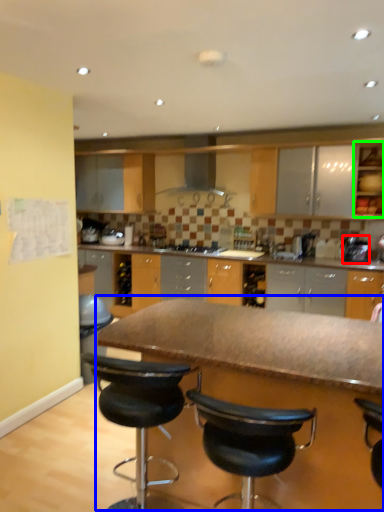
Question: Based on their relative distances, which object is farther from appliance (highlighted by a red box)? Choose from table (highlighted by a blue box) and cabinetry (highlighted by a green box).

Choices:
 (A) table
 (B) cabinetry

Answer: (A)